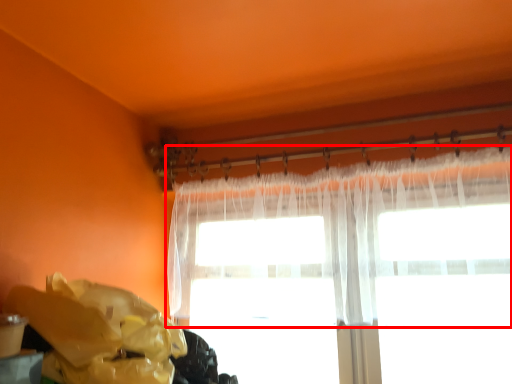
Question: In this image, where is curtain (annotated by the red box) located relative to waste?

Choices:
 (A) right
 (B) left

Answer: (A)